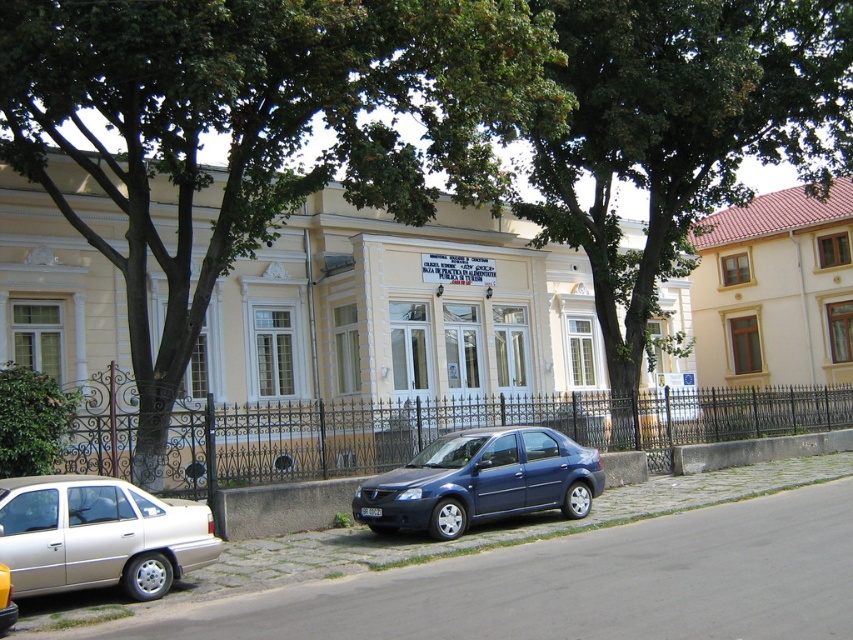
Question: Which object appears closest to the camera in this image?

Choices:
 (A) green leafy tree at upper center
 (B) metallic silver sedan at lower left
 (C) green leafy tree at center
 (D) gray concrete curb at lower center

Answer: (D)

Question: Where is green leafy tree at upper center located in relation to satin blue sedan at center in the image?

Choices:
 (A) left
 (B) right

Answer: (A)

Question: Does green leafy tree at upper center have a lesser width compared to green leafy tree at center?

Choices:
 (A) yes
 (B) no

Answer: (B)

Question: Which of the following is the farthest from the observer?

Choices:
 (A) (496, 440)
 (B) (45, 561)
 (C) (457, 547)
 (D) (573, 58)

Answer: (D)

Question: From the image, what is the correct spatial relationship of green leafy tree at upper center in relation to green leafy tree at center?

Choices:
 (A) left
 (B) right

Answer: (A)

Question: Which point is closer to the camera taking this photo?

Choices:
 (A) (450, 472)
 (B) (618, 104)

Answer: (A)